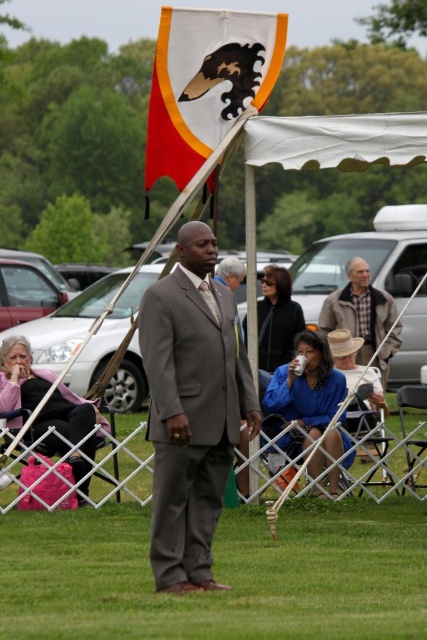
Is white fabric flag with black and gold design at upper center smaller than pink fabric bag at lower left?

Indeed, white fabric flag with black and gold design at upper center has a smaller size compared to pink fabric bag at lower left.

Is point (178, 106) positioned behind point (5, 348)?

Yes, point (178, 106) is farther from viewer.

This screenshot has height=640, width=427. I want to click on white fabric flag with black and gold design at upper center, so click(x=205, y=83).

Which of these two, matte gray suit at center or pink fabric bag at lower left, stands taller?

matte gray suit at center is taller.

Can you confirm if matte gray suit at center is taller than pink fabric bag at lower left?

Yes, matte gray suit at center is taller than pink fabric bag at lower left.

Where is `matte gray suit at center`? Image resolution: width=427 pixels, height=640 pixels. matte gray suit at center is located at coordinates click(x=192, y=408).

In order to click on matte gray suit at center in this screenshot , I will do `click(192, 408)`.

Which is more to the right, blue fabric shirt at lower center or pink fabric bag at lower left?

From the viewer's perspective, blue fabric shirt at lower center appears more on the right side.

At what (x,y) coordinates should I click in order to perform the action: click on blue fabric shirt at lower center. Please return your answer as a coordinate pair (x, y). Looking at the image, I should click on (306, 392).